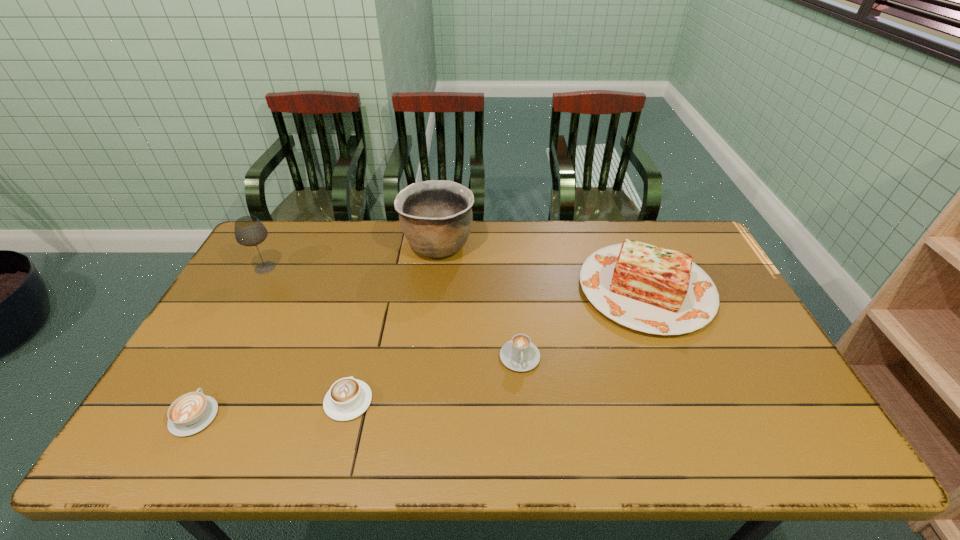
Where is `free space that satisfies the following two spatial constraints: 1. on the side of the pottery with the handle; 2. on the left side of the shortest cappuccino`? This screenshot has height=540, width=960. free space that satisfies the following two spatial constraints: 1. on the side of the pottery with the handle; 2. on the left side of the shortest cappuccino is located at coordinates (285, 245).